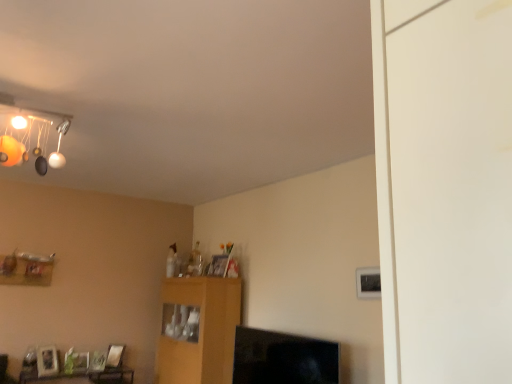
Question: Could you tell me if wooden cabinet at center is facing wooden table at lower left?

Choices:
 (A) yes
 (B) no

Answer: (A)

Question: Is wooden cabinet at center taller than wooden table at lower left?

Choices:
 (A) no
 (B) yes

Answer: (B)

Question: Is wooden table at lower left a part of wooden cabinet at center?

Choices:
 (A) yes
 (B) no

Answer: (B)

Question: Does wooden cabinet at center have a greater width compared to wooden table at lower left?

Choices:
 (A) no
 (B) yes

Answer: (B)

Question: Considering the relative positions of wooden cabinet at center and wooden table at lower left in the image provided, is wooden cabinet at center in front of wooden table at lower left?

Choices:
 (A) no
 (B) yes

Answer: (B)

Question: From the image's perspective, is wooden table at lower left positioned above or below wooden cabinet at center?

Choices:
 (A) above
 (B) below

Answer: (B)

Question: Considering the positions of wooden table at lower left and wooden cabinet at center in the image, is wooden table at lower left wider or thinner than wooden cabinet at center?

Choices:
 (A) thin
 (B) wide

Answer: (A)

Question: Would you say wooden table at lower left is to the left or to the right of wooden cabinet at center in the picture?

Choices:
 (A) left
 (B) right

Answer: (A)

Question: From a real-world perspective, is wooden table at lower left physically located above or below wooden cabinet at center?

Choices:
 (A) above
 (B) below

Answer: (B)

Question: Considering the positions of wooden shelf at lower left and wooden cabinet at center in the image, is wooden shelf at lower left taller or shorter than wooden cabinet at center?

Choices:
 (A) tall
 (B) short

Answer: (B)

Question: From the image's perspective, relative to wooden cabinet at center, is wooden shelf at lower left above or below?

Choices:
 (A) above
 (B) below

Answer: (A)

Question: From a real-world perspective, is wooden shelf at lower left physically located above or below wooden cabinet at center?

Choices:
 (A) above
 (B) below

Answer: (A)

Question: Considering their positions, is wooden shelf at lower left located in front of or behind wooden cabinet at center?

Choices:
 (A) behind
 (B) front

Answer: (A)

Question: From the image's perspective, is wooden table at lower left above or below wooden shelf at lower left?

Choices:
 (A) below
 (B) above

Answer: (A)

Question: From a real-world perspective, relative to wooden shelf at lower left, is wooden table at lower left vertically above or below?

Choices:
 (A) below
 (B) above

Answer: (A)